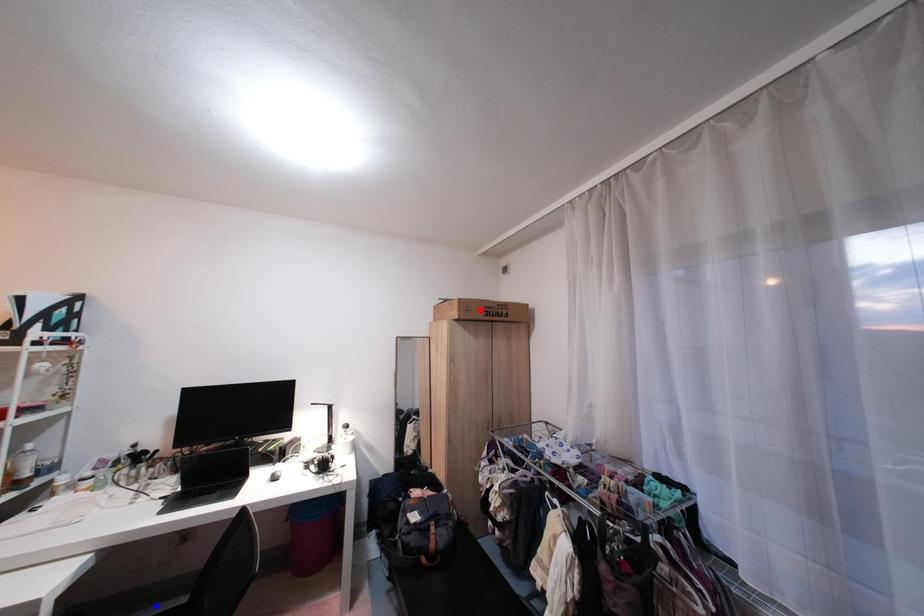
Question: Two points are marked on the image. Which point is closer to the camera?

Choices:
 (A) Blue point is closer.
 (B) Red point is closer.

Answer: (A)